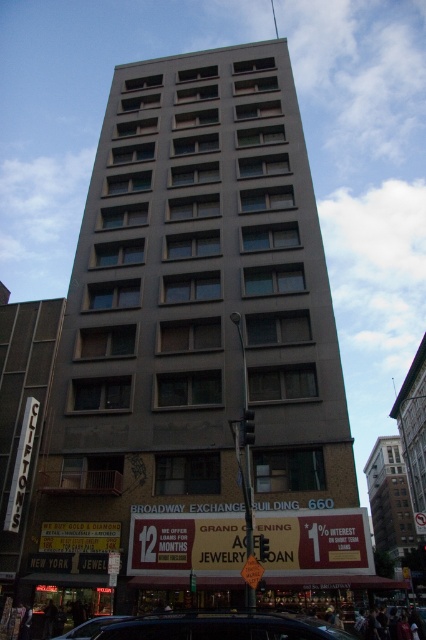
Is gray concrete building at center positioned at the back of shiny black car at lower left?

Yes.

Which is more to the left, gray concrete building at center or shiny black car at lower left?

shiny black car at lower left

Is point (328, 403) positioned before point (115, 616)?

No.

You are a GUI agent. You are given a task and a screenshot of the screen. Output one action in this format:
    pyautogui.click(x=<x>, y=<y>)
    Task: Click on the gray concrete building at center
    Image resolution: width=426 pixels, height=640 pixels.
    Given the screenshot: What is the action you would take?
    pyautogui.click(x=195, y=342)

Who is more distant from viewer, (175, 627) or (94, 620)?

Point (94, 620)

Looking at this image, is shiny black car at lower center below shiny black car at lower left?

Actually, shiny black car at lower center is above shiny black car at lower left.

Which is behind, point (184, 637) or point (86, 637)?

Point (86, 637)

Locate an element on the screen. Image resolution: width=426 pixels, height=640 pixels. shiny black car at lower center is located at coordinates (221, 627).

Can you confirm if gray concrete building at center is positioned above shiny black car at lower center?

Indeed, gray concrete building at center is positioned over shiny black car at lower center.

Is gray concrete building at center closer to camera compared to shiny black car at lower center?

No.

Who is more distant from viewer, (98, 294) or (305, 621)?

Point (98, 294)

I want to click on gray concrete building at center, so click(x=195, y=342).